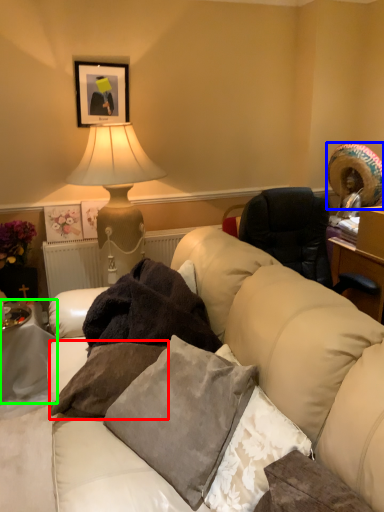
Question: Based on their relative distances, which object is nearer to pillow (highlighted by a red box)? Choose from straw hat (highlighted by a blue box) and table (highlighted by a green box).

Choices:
 (A) straw hat
 (B) table

Answer: (B)